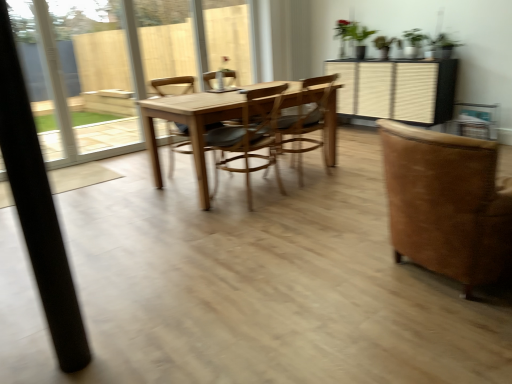
Where is `free point to the right of black matte pole at left`? The height and width of the screenshot is (384, 512). free point to the right of black matte pole at left is located at coordinates (119, 352).